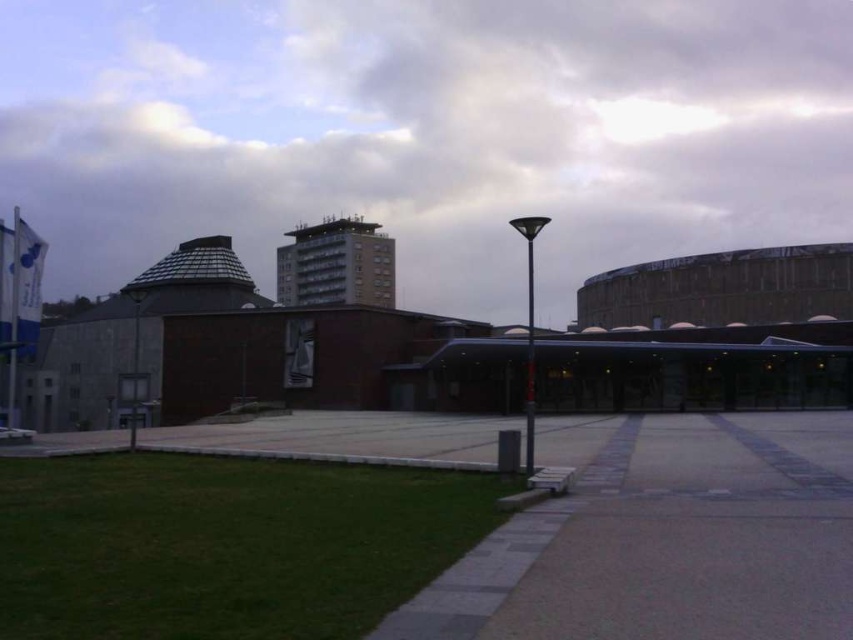
Can you confirm if white fluffy cloud at upper center is thinner than gray concrete pavement at center?

No.

Based on the photo, is white fluffy cloud at upper center to the right of gray concrete pavement at center from the viewer's perspective?

In fact, white fluffy cloud at upper center is to the left of gray concrete pavement at center.

Who is more distant from viewer, (306, 84) or (746, 561)?

Positioned behind is point (306, 84).

Where is `white fluffy cloud at upper center`? white fluffy cloud at upper center is located at coordinates (427, 132).